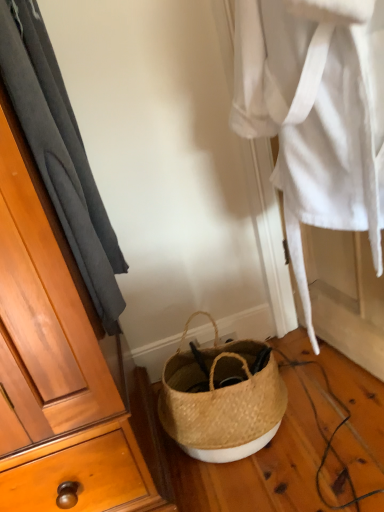
Question: In the image, is white woven robe at center on the left side or the right side of natural woven basket at lower center?

Choices:
 (A) right
 (B) left

Answer: (A)

Question: Considering the positions of white woven robe at center and natural woven basket at lower center in the image, is white woven robe at center bigger or smaller than natural woven basket at lower center?

Choices:
 (A) big
 (B) small

Answer: (A)

Question: Which object is positioned closest to the white woven robe at center?

Choices:
 (A) natural woven basket at lower center
 (B) dark gray fabric at left

Answer: (B)

Question: Which of these objects is positioned farthest from the natural woven basket at lower center?

Choices:
 (A) white woven robe at center
 (B) dark gray fabric at left

Answer: (B)